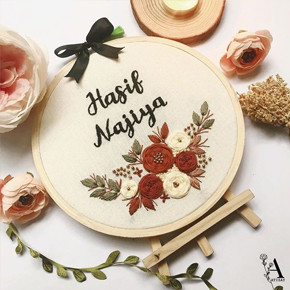
This screenshot has height=290, width=290. What are the coordinates of `wooden stand` in the screenshot? It's located at (196, 235).